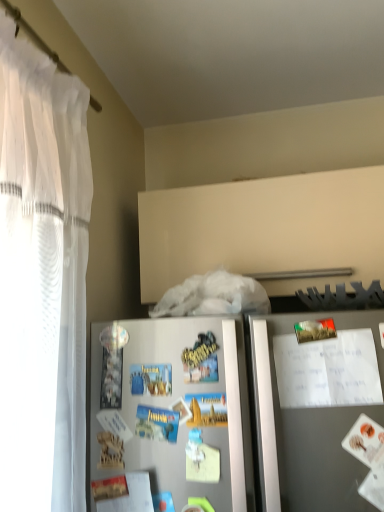
Question: Considering the relative sizes of white paper at upper right and satin silver refrigerator at lower center in the image provided, is white paper at upper right bigger than satin silver refrigerator at lower center?

Choices:
 (A) no
 (B) yes

Answer: (A)

Question: From the image's perspective, is white paper at upper right beneath satin silver refrigerator at lower center?

Choices:
 (A) yes
 (B) no

Answer: (B)

Question: Can you see white paper at upper right touching satin silver refrigerator at lower center?

Choices:
 (A) no
 (B) yes

Answer: (A)

Question: Is white paper at upper right looking in the opposite direction of satin silver refrigerator at lower center?

Choices:
 (A) yes
 (B) no

Answer: (A)

Question: Does white paper at upper right appear on the left side of satin silver refrigerator at lower center?

Choices:
 (A) no
 (B) yes

Answer: (A)

Question: Considering the relative sizes of white paper at upper right and satin silver refrigerator at lower center in the image provided, is white paper at upper right thinner than satin silver refrigerator at lower center?

Choices:
 (A) no
 (B) yes

Answer: (A)

Question: Is satin silver refrigerator at lower center positioned before white paper at upper right?

Choices:
 (A) no
 (B) yes

Answer: (B)

Question: Is satin silver refrigerator at lower center shorter than white paper at upper right?

Choices:
 (A) yes
 (B) no

Answer: (B)

Question: Can you confirm if satin silver refrigerator at lower center is positioned to the left of white paper at upper right?

Choices:
 (A) no
 (B) yes

Answer: (B)

Question: From a real-world perspective, is satin silver refrigerator at lower center physically above white paper at upper right?

Choices:
 (A) yes
 (B) no

Answer: (B)

Question: Are satin silver refrigerator at lower center and white paper at upper right making contact?

Choices:
 (A) yes
 (B) no

Answer: (B)

Question: Could you tell me if satin silver refrigerator at lower center is facing white paper at upper right?

Choices:
 (A) yes
 (B) no

Answer: (A)

Question: Based on their positions, is satin silver refrigerator at lower center located to the left or right of white paper at upper right?

Choices:
 (A) left
 (B) right

Answer: (A)